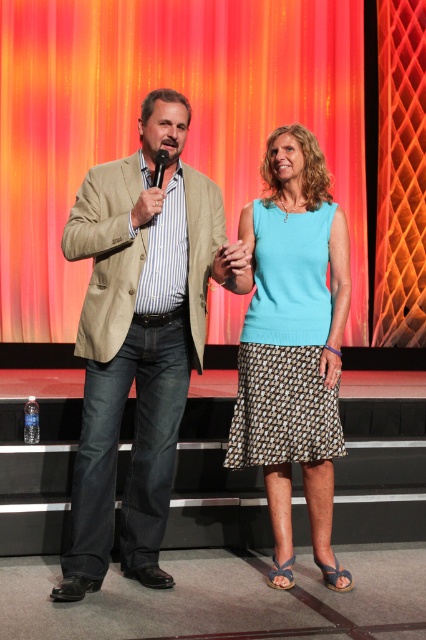
Does orange fabric curtain at upper center have a larger size compared to light blue fabric skirt at center?

Correct, orange fabric curtain at upper center is larger in size than light blue fabric skirt at center.

Is orange fabric curtain at upper center below light blue fabric skirt at center?

Actually, orange fabric curtain at upper center is above light blue fabric skirt at center.

Identify the location of orange fabric curtain at upper center. Image resolution: width=426 pixels, height=640 pixels. (189, 125).

Can you confirm if beige textured blazer at center is thinner than light blue fabric skirt at center?

Incorrect, beige textured blazer at center's width is not less than light blue fabric skirt at center's.

Who is taller, beige textured blazer at center or light blue fabric skirt at center?

beige textured blazer at center is taller.

The height and width of the screenshot is (640, 426). I want to click on beige textured blazer at center, so click(x=137, y=339).

Can you confirm if orange fabric curtain at upper center is wider than beige textured blazer at center?

Yes.

Between orange fabric curtain at upper center and beige textured blazer at center, which one is positioned lower?

beige textured blazer at center is below.

This screenshot has width=426, height=640. What are the coordinates of `orange fabric curtain at upper center` in the screenshot? It's located at (189, 125).